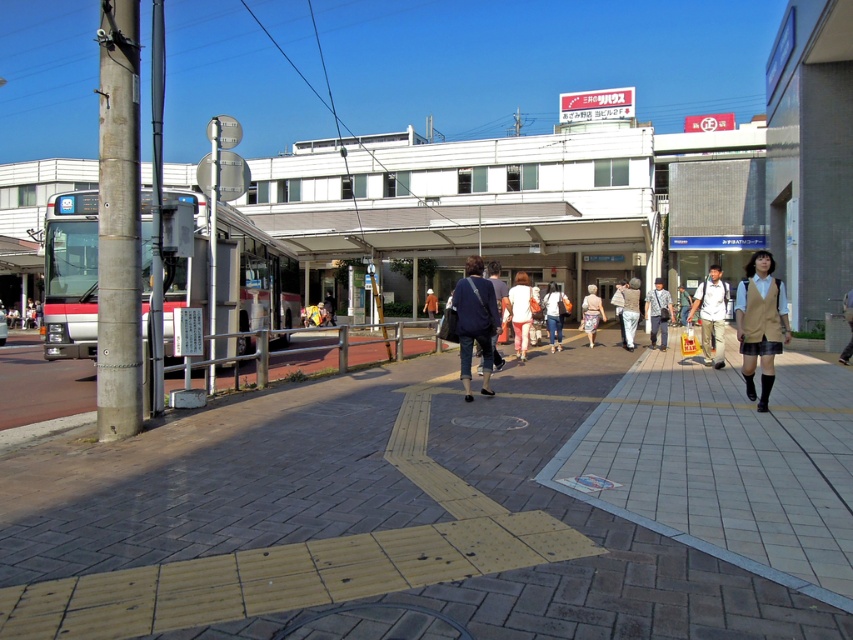
Does light brown uniform skirt at lower right have a greater width compared to light beige pants at center?

No.

Is light brown uniform skirt at lower right smaller than light beige pants at center?

Correct, light brown uniform skirt at lower right occupies less space than light beige pants at center.

Which is behind, point (756, 296) or point (630, 339)?

Positioned behind is point (630, 339).

Image resolution: width=853 pixels, height=640 pixels. I want to click on light brown uniform skirt at lower right, so click(x=759, y=323).

Measure the distance between denim jacket at center and dark blue jeans at center.

They are 13.37 meters apart.

This screenshot has width=853, height=640. Describe the element at coordinates (554, 314) in the screenshot. I see `denim jacket at center` at that location.

Locate an element on the screen. This screenshot has height=640, width=853. denim jacket at center is located at coordinates (554, 314).

Is dark gray fabric bag at center taller than floral skirt at center?

Correct, dark gray fabric bag at center is much taller as floral skirt at center.

Who is higher up, dark gray fabric bag at center or floral skirt at center?

dark gray fabric bag at center

At what (x,y) coordinates should I click in order to perform the action: click on dark gray fabric bag at center. Please return your answer as a coordinate pair (x, y). Looking at the image, I should click on (659, 312).